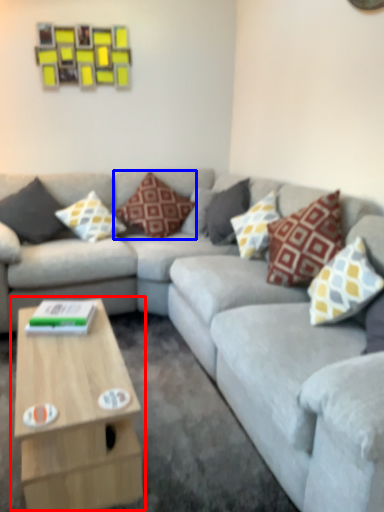
Question: Which object appears closest to the camera in this image, coffee table (highlighted by a red box) or pillow (highlighted by a blue box)?

Choices:
 (A) coffee table
 (B) pillow

Answer: (A)